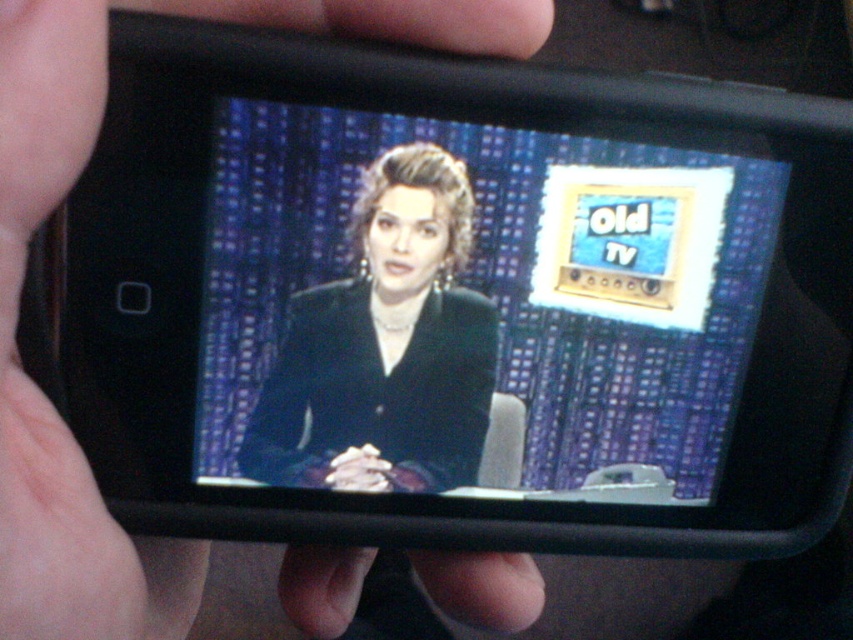
Question: Which object appears closest to the camera in this image?

Choices:
 (A) shiny black screen at center
 (B) black velvet suit at center
 (C) black matte skin at upper left

Answer: (C)

Question: Which point appears closest to the camera in this image?

Choices:
 (A) (10, 422)
 (B) (392, 323)
 (C) (235, 476)

Answer: (A)

Question: Is the position of shiny black screen at center less distant than that of black matte skin at upper left?

Choices:
 (A) yes
 (B) no

Answer: (B)

Question: Based on their relative distances, which object is farther from the black matte skin at upper left?

Choices:
 (A) shiny black screen at center
 (B) black velvet suit at center

Answer: (B)

Question: Is black matte skin at upper left above black velvet suit at center?

Choices:
 (A) yes
 (B) no

Answer: (B)

Question: Observing the image, what is the correct spatial positioning of shiny black screen at center in reference to black matte skin at upper left?

Choices:
 (A) below
 (B) above

Answer: (B)